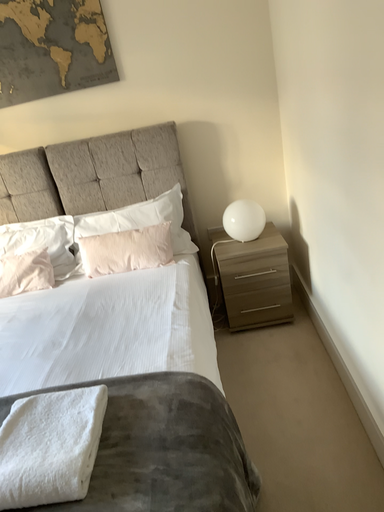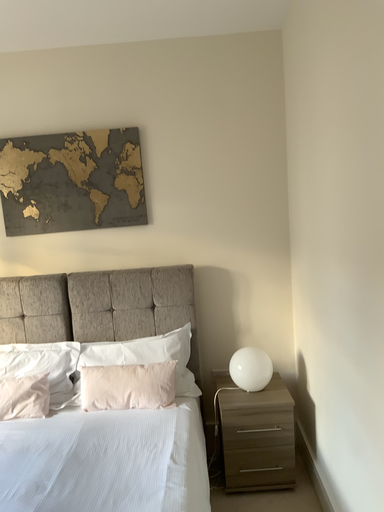
Question: Which way did the camera rotate in the video?

Choices:
 (A) rotated downward
 (B) rotated upward

Answer: (B)